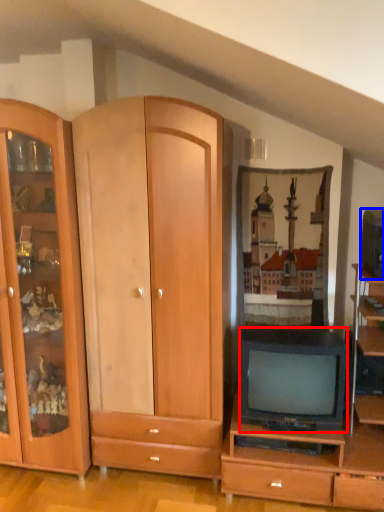
Question: Which point is closer to the camera, television (highlighted by a red box) or television (highlighted by a blue box)?

Choices:
 (A) television
 (B) television

Answer: (B)